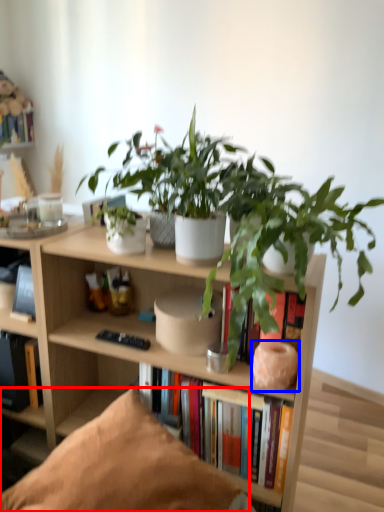
Question: Which point is further to the camera, pillow (highlighted by a red box) or vase (highlighted by a blue box)?

Choices:
 (A) pillow
 (B) vase

Answer: (B)